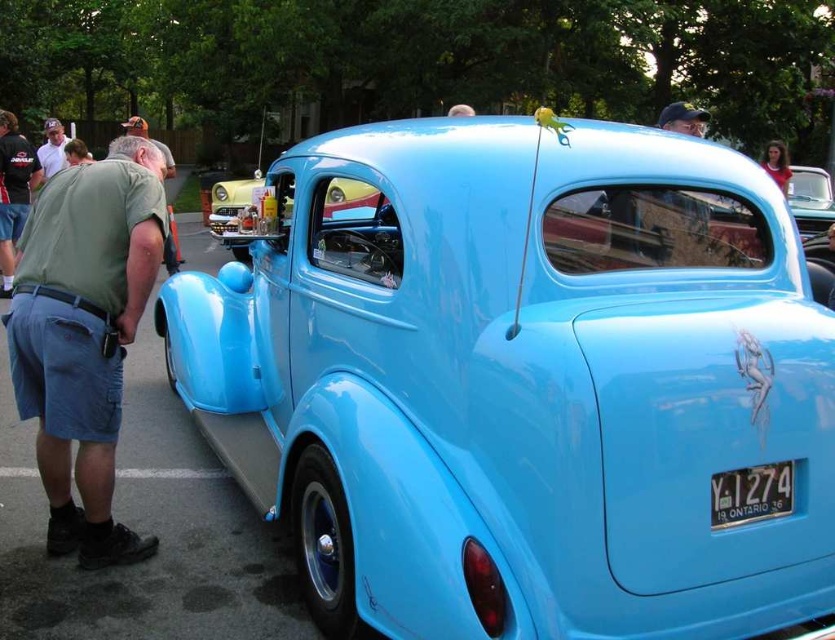
Can you confirm if green cotton shirt at left is positioned to the right of black metal/license plate at lower right?

Incorrect, green cotton shirt at left is not on the right side of black metal/license plate at lower right.

Describe the element at coordinates (84, 333) in the screenshot. I see `green cotton shirt at left` at that location.

Locate an element on the screen. The width and height of the screenshot is (835, 640). green cotton shirt at left is located at coordinates (84, 333).

Is green cotton shirt at left wider than matte black cap at upper center?

No.

Is green cotton shirt at left in front of matte black cap at upper center?

Yes, green cotton shirt at left is in front of matte black cap at upper center.

You are a GUI agent. You are given a task and a screenshot of the screen. Output one action in this format:
    pyautogui.click(x=<x>, y=<y>)
    Task: Click on the green cotton shirt at left
    The width and height of the screenshot is (835, 640).
    Given the screenshot: What is the action you would take?
    pyautogui.click(x=84, y=333)

This screenshot has height=640, width=835. What do you see at coordinates (52, 148) in the screenshot? I see `matte green shirt at upper left` at bounding box center [52, 148].

Locate an element on the screen. matte green shirt at upper left is located at coordinates (x=52, y=148).